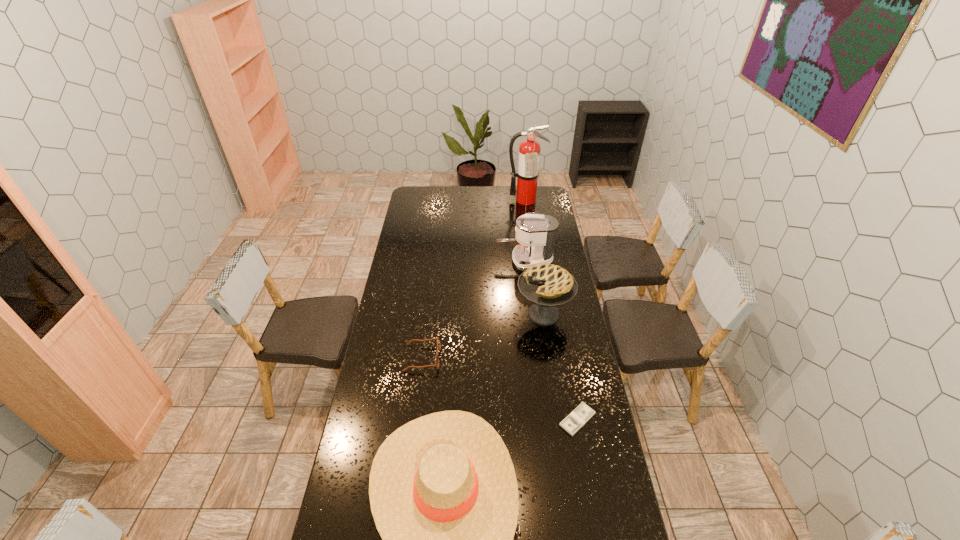
I want to click on the tallest object, so (527, 174).

I want to click on the farthest object, so click(x=527, y=174).

The image size is (960, 540). What are the coordinates of `the second farthest object` in the screenshot? It's located at (536, 233).

Locate an element on the screen. The width and height of the screenshot is (960, 540). the third farthest object is located at coordinates (547, 286).

Identify the location of spectacles. (438, 339).

Where is `the fifth tallest object`? This screenshot has width=960, height=540. the fifth tallest object is located at coordinates (438, 339).

The width and height of the screenshot is (960, 540). What are the coordinates of `the shortest object` in the screenshot? It's located at (582, 414).

At what (x,y) coordinates should I click in order to perform the action: click on vacant space located 0.260m on the nozzle side of the tallest object. Please return your answer as a coordinate pair (x, y). Looking at the image, I should click on tap(530, 230).

Find the location of a particular element. The height and width of the screenshot is (540, 960). free space located on the front-facing side of the fifth nearest object is located at coordinates (428, 261).

I want to click on free space located 0.210m on the front-facing side of the fifth nearest object, so click(455, 261).